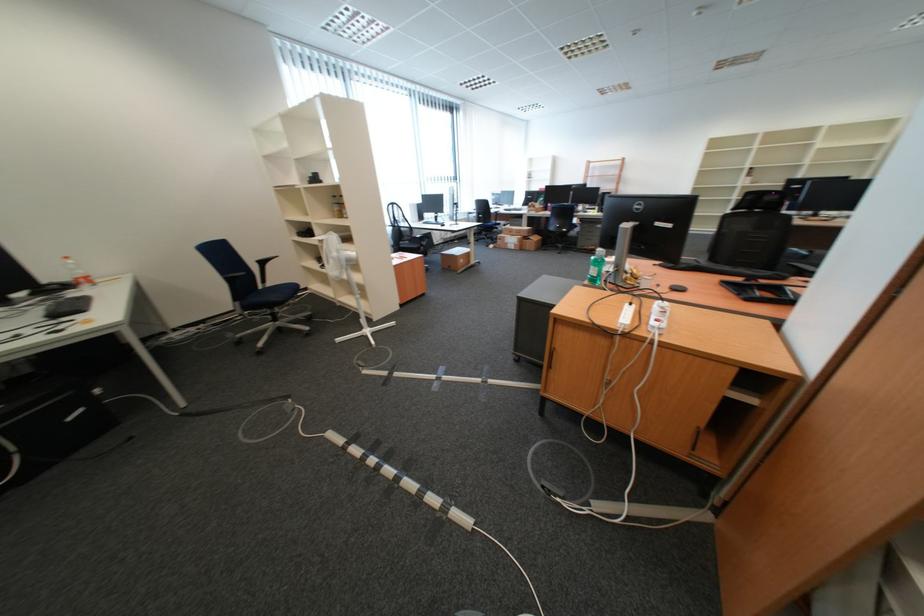
Locate an element on the screen. black chair armrest is located at coordinates (234, 274).